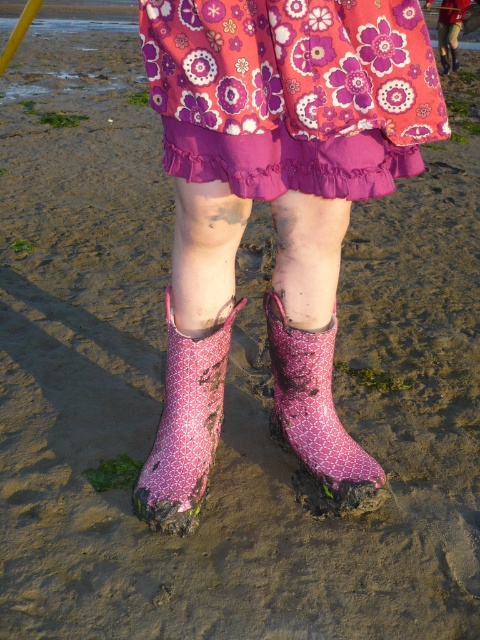
Question: Which of the following is the closest to the observer?

Choices:
 (A) (208, 396)
 (B) (418, 58)
 (C) (276, 358)

Answer: (B)

Question: Can you confirm if pink fabric boot at lower center is positioned below pink rubber boot at lower center?

Choices:
 (A) no
 (B) yes

Answer: (B)

Question: Which point is closer to the camera?

Choices:
 (A) pink fabric boot at lower center
 (B) pink rubber boots at center
 (C) pink floral fabric skirt at upper center

Answer: (C)

Question: Which point is farther to the camera?

Choices:
 (A) (215, 410)
 (B) (275, 186)
 (C) (280, 307)
 (D) (283, 396)

Answer: (D)

Question: Considering the relative positions of pink floral fabric skirt at upper center and pink rubber boot at lower center in the image provided, where is pink floral fabric skirt at upper center located with respect to pink rubber boot at lower center?

Choices:
 (A) above
 (B) below

Answer: (A)

Question: Can you confirm if pink floral fabric skirt at upper center is positioned to the left of pink rubber boot at lower center?

Choices:
 (A) no
 (B) yes

Answer: (B)